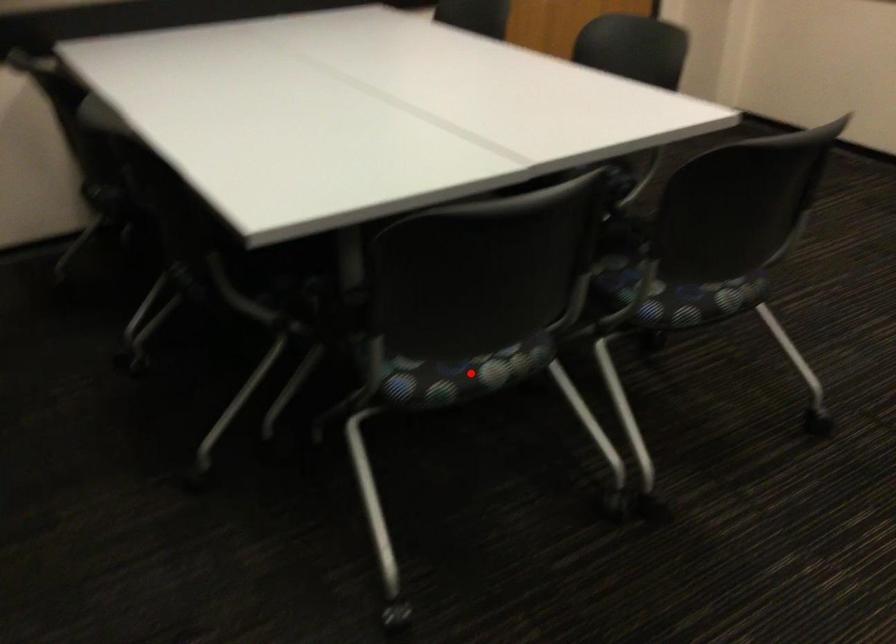
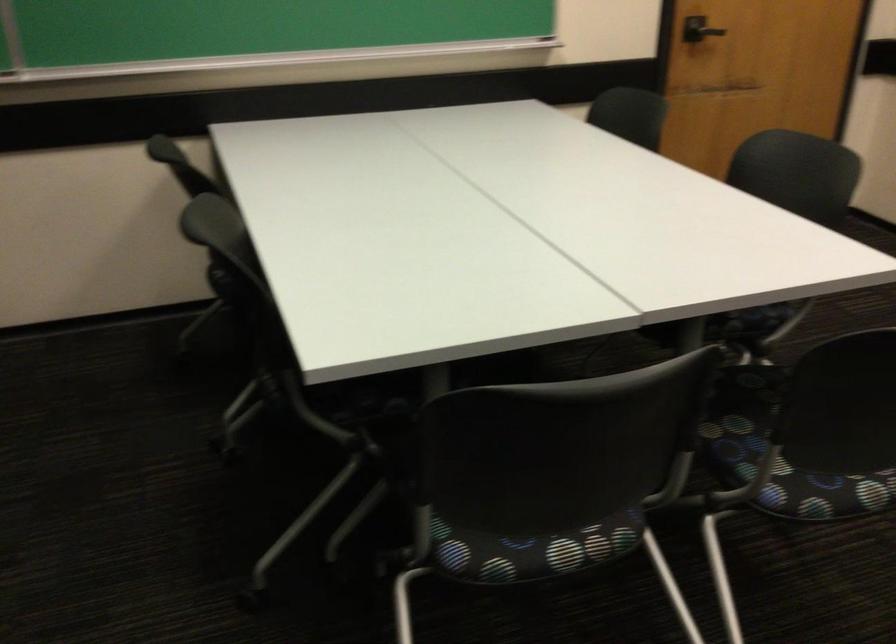
Where in the second image is the point corresponding to the highlighted location from the first image?

(531, 550)